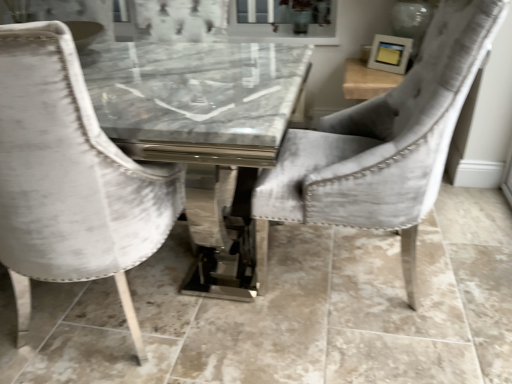
Where is `unoccupied region to the right of velvet white chair at left, the second chair positioned from the right`? unoccupied region to the right of velvet white chair at left, the second chair positioned from the right is located at coordinates (239, 330).